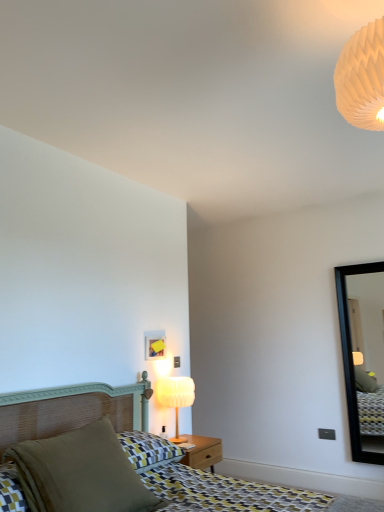
What is the approximate width of matte wicker bed at lower left?

It is 6.54 feet.

Locate an element on the screen. white paper honeycomb at upper right is located at coordinates (362, 78).

In the scene shown: In order to face matte yellow picture frame at center, should I rotate leftwards or rightwards?

Rotate left and turn 4.623 degrees.

At what (x,y) coordinates should I click in order to perform the action: click on matte wicker bed at lower left. Please return your answer as a coordinate pair (x, y). Image resolution: width=384 pixels, height=512 pixels. Looking at the image, I should click on (67, 410).

Based on the photo, how many degrees apart are the facing directions of matte yellow picture frame at center and white paper honeycomb at upper right?

There is a 179-degree angle between the facing directions of matte yellow picture frame at center and white paper honeycomb at upper right.

Is matte yellow picture frame at center spatially inside white paper honeycomb at upper right, or outside of it?

The correct answer is: outside.

Which is less distant, (x=156, y=354) or (x=355, y=33)?

Point (x=156, y=354).

Which is more to the right, matte yellow picture frame at center or white paper honeycomb at upper right?

Positioned to the right is white paper honeycomb at upper right.

Which of these two, matte green pillow at lower left or black frame mirror at right, is bigger?

matte green pillow at lower left is bigger.

Find the location of a particular element. The width and height of the screenshot is (384, 512). pillow below the black frame mirror at right (from the image's perspective) is located at coordinates (81, 473).

Is matte green pillow at lower left to the right of black frame mirror at right from the viewer's perspective?

Incorrect, matte green pillow at lower left is not on the right side of black frame mirror at right.

Is matte green pillow at lower left oriented towards black frame mirror at right?

No, matte green pillow at lower left is not facing towards black frame mirror at right.

Is point (173, 406) behind point (101, 508)?

Yes.

Is matte white lamp at center at the right side of matte green pillow at lower left?

Yes, matte white lamp at center is to the right of matte green pillow at lower left.

Where is `pillow above the matte white lamp at center (from the image's perspective)`? The height and width of the screenshot is (512, 384). pillow above the matte white lamp at center (from the image's perspective) is located at coordinates (81, 473).

Is matte white lamp at center oriented away from matte green pillow at lower left?

matte white lamp at center is not turned away from matte green pillow at lower left.

Is black frame mirror at right inside or outside of white paper honeycomb at upper right?

black frame mirror at right lies outside white paper honeycomb at upper right.

In the scene shown: Is black frame mirror at right shorter than white paper honeycomb at upper right?

No, black frame mirror at right is not shorter than white paper honeycomb at upper right.

Are black frame mirror at right and white paper honeycomb at upper right beside each other?

No.

You are a GUI agent. You are given a task and a screenshot of the screen. Output one action in this format:
    pyautogui.click(x=<x>, y=<y>)
    Task: Click on the lamp above the black frame mirror at right (from the image's perspective)
    Image resolution: width=384 pixels, height=512 pixels.
    Given the screenshot: What is the action you would take?
    362,78

Is matte green pillow at lower left located outside white paper honeycomb at upper right?

Yes.

Which of these two, matte green pillow at lower left or white paper honeycomb at upper right, stands taller?

white paper honeycomb at upper right is taller.

Can you confirm if matte green pillow at lower left is thinner than white paper honeycomb at upper right?

No, matte green pillow at lower left is not thinner than white paper honeycomb at upper right.

Is matte green pillow at lower left to the right of white paper honeycomb at upper right from the viewer's perspective?

No, matte green pillow at lower left is not to the right of white paper honeycomb at upper right.

Measure the distance from black frame mirror at right to matte yellow picture frame at center.

1.75 meters.

Are black frame mirror at right and matte yellow picture frame at center far apart?

Absolutely, black frame mirror at right is distant from matte yellow picture frame at center.

Which is behind, black frame mirror at right or matte yellow picture frame at center?

black frame mirror at right is behind.

In the scene shown: Can you confirm if black frame mirror at right is taller than matte yellow picture frame at center?

Correct, black frame mirror at right is much taller as matte yellow picture frame at center.

Considering the points (365, 80) and (380, 423), which point is behind, point (365, 80) or point (380, 423)?

The point (380, 423) is farther from the camera.

From a real-world perspective, is white paper honeycomb at upper right located beneath black frame mirror at right?

No, from a real-world perspective, white paper honeycomb at upper right is not under black frame mirror at right.

Is black frame mirror at right at the back of white paper honeycomb at upper right?

That's not correct — white paper honeycomb at upper right is not looking away from black frame mirror at right.

Locate an element on the screen. Image resolution: width=384 pixels, height=512 pixels. picture frame located on the left of white paper honeycomb at upper right is located at coordinates (155, 345).

What are the coordinates of `mirror above the matte green pillow at lower left (from the image's perspective)` in the screenshot? It's located at (363, 356).

Estimate the real-world distances between objects in this image. Which object is further from black frame mirror at right, matte yellow picture frame at center or white paper honeycomb at upper right?

The object further to black frame mirror at right is white paper honeycomb at upper right.

From the picture: When comparing their distances from white paper honeycomb at upper right, does black frame mirror at right or matte yellow picture frame at center seem further?

The object further to white paper honeycomb at upper right is black frame mirror at right.

Estimate the real-world distances between objects in this image. Which object is closer to black frame mirror at right, matte yellow picture frame at center or matte wicker bed at lower left?

matte yellow picture frame at center lies closer to black frame mirror at right than the other object.

Estimate the real-world distances between objects in this image. Which object is further from matte yellow picture frame at center, matte white lamp at center or black frame mirror at right?

black frame mirror at right is further to matte yellow picture frame at center.

Looking at the image, which one is located closer to black frame mirror at right, white paper honeycomb at upper right or matte white lamp at center?

matte white lamp at center is closer to black frame mirror at right.

Looking at the image, which one is located further to black frame mirror at right, matte white lamp at center or white paper honeycomb at upper right?

The object further to black frame mirror at right is white paper honeycomb at upper right.

Based on their spatial positions, is matte green pillow at lower left or matte wicker bed at lower left closer to matte yellow picture frame at center?

matte wicker bed at lower left lies closer to matte yellow picture frame at center than the other object.

Based on their spatial positions, is matte yellow picture frame at center or matte white lamp at center further from black frame mirror at right?

The object further to black frame mirror at right is matte yellow picture frame at center.

You are a GUI agent. You are given a task and a screenshot of the screen. Output one action in this format:
    pyautogui.click(x=<x>, y=<y>)
    Task: Click on the pillow that lies between white paper honeycomb at upper right and matte white lamp at center from top to bottom
    
    Given the screenshot: What is the action you would take?
    pyautogui.click(x=81, y=473)

Locate an element on the screen. pillow between white paper honeycomb at upper right and matte yellow picture frame at center from front to back is located at coordinates (81, 473).

This screenshot has width=384, height=512. Find the location of `table lamp between matte yellow picture frame at center and black frame mirror at right in the horizontal direction`. table lamp between matte yellow picture frame at center and black frame mirror at right in the horizontal direction is located at coordinates (176, 398).

The height and width of the screenshot is (512, 384). I want to click on picture frame located between matte wicker bed at lower left and black frame mirror at right in the depth direction, so click(155, 345).